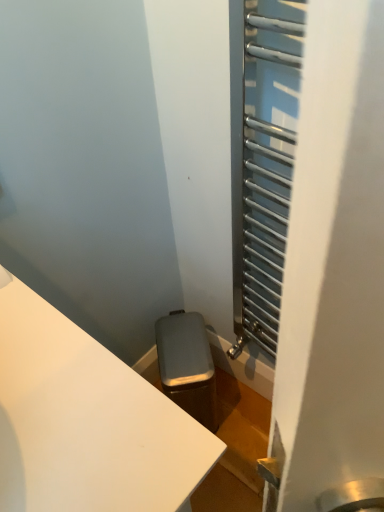
Describe the element at coordinates (334, 273) in the screenshot. I see `metallic silver radiator at right` at that location.

Image resolution: width=384 pixels, height=512 pixels. In order to click on metallic silver radiator at right in this screenshot , I will do `click(334, 273)`.

The height and width of the screenshot is (512, 384). I want to click on metallic silver radiator at right, so click(x=334, y=273).